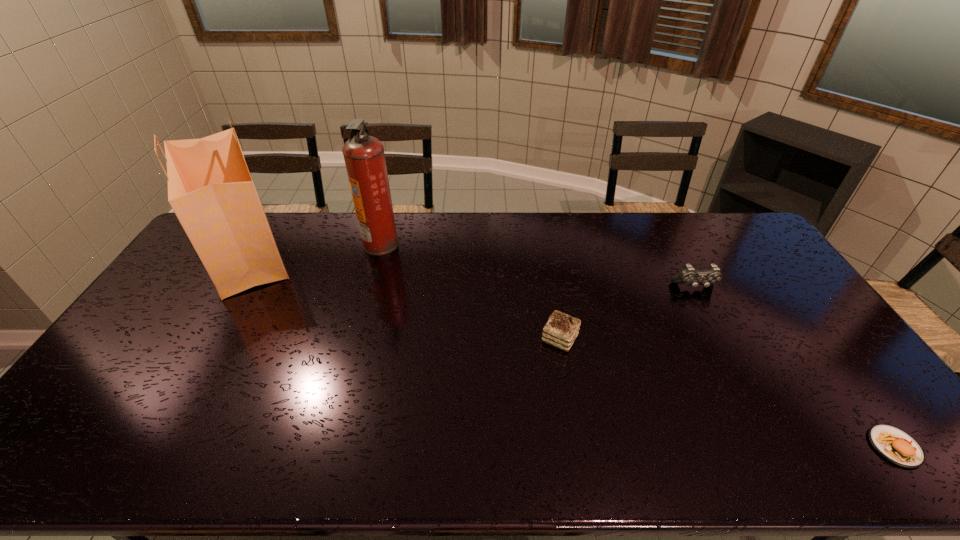
Locate an element on the screen. free spot that satisfies the following two spatial constraints: 1. on the front side of the fourth farthest object; 2. on the left side of the patty is located at coordinates (579, 447).

Find the location of a particular element. Image resolution: width=960 pixels, height=540 pixels. free point that satisfies the following two spatial constraints: 1. on the back side of the second nearest object; 2. on the side of the grocery bag with the superhero design is located at coordinates (545, 255).

The height and width of the screenshot is (540, 960). Identify the location of free space that satisfies the following two spatial constraints: 1. on the side of the leftmost object with the superhero design; 2. on the right side of the nearest object. (129, 447).

Find the location of a particular element. This screenshot has width=960, height=540. vacant space that satisfies the following two spatial constraints: 1. on the surface of the shortest object with buttons; 2. on the left side of the control is located at coordinates (778, 447).